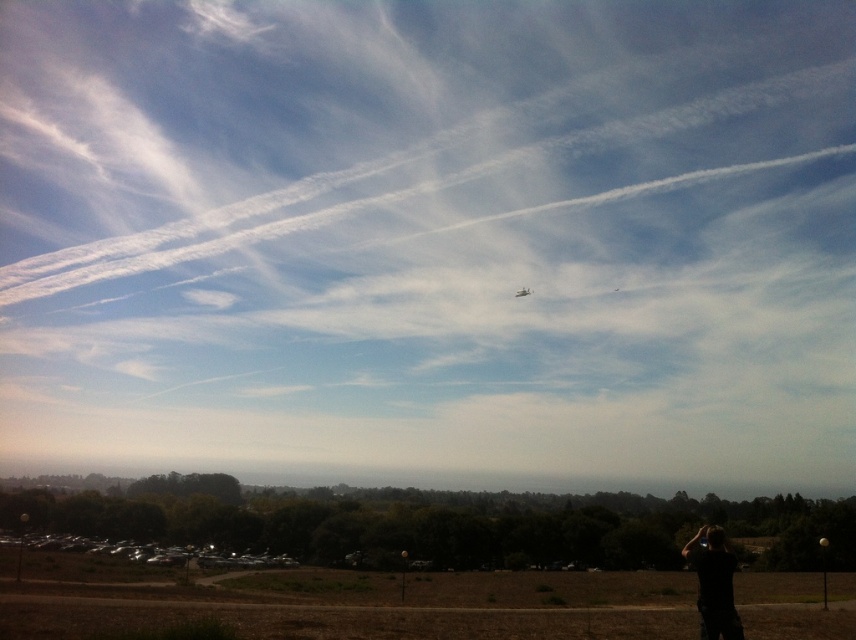
Question: Can you confirm if black fabric person at lower right is smaller than metallic silver airplane at center?

Choices:
 (A) yes
 (B) no

Answer: (B)

Question: Which of the following is the farthest from the observer?

Choices:
 (A) (522, 288)
 (B) (712, 634)

Answer: (A)

Question: Does black fabric person at lower right come in front of metallic silver airplane at center?

Choices:
 (A) yes
 (B) no

Answer: (A)

Question: Which point is closer to the camera taking this photo?

Choices:
 (A) tap(721, 552)
 (B) tap(520, 291)

Answer: (A)

Question: In this image, where is black fabric person at lower right located relative to metallic silver airplane at center?

Choices:
 (A) above
 (B) below

Answer: (B)